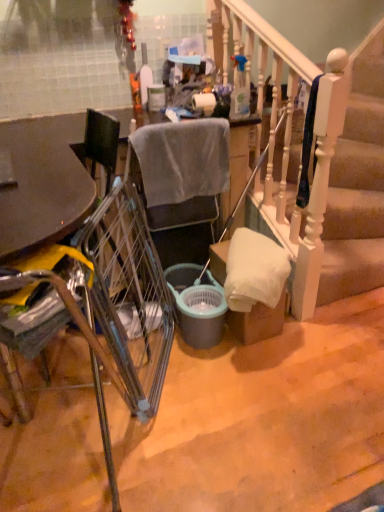
Image resolution: width=384 pixels, height=512 pixels. I want to click on vacant area that lies between metallic silver trolley at center and matte gray bucket at center, so click(x=190, y=380).